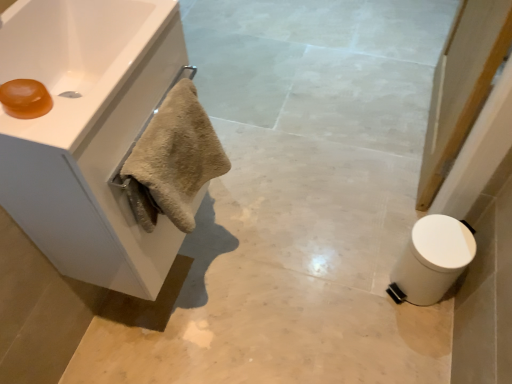
You are a GUI agent. You are given a task and a screenshot of the screen. Output one action in this format:
    pyautogui.click(x=<x>, y=<y>)
    Task: Click on the free location above white marble towel at left (from a real-world perspective)
    
    Given the screenshot: What is the action you would take?
    pyautogui.click(x=278, y=304)